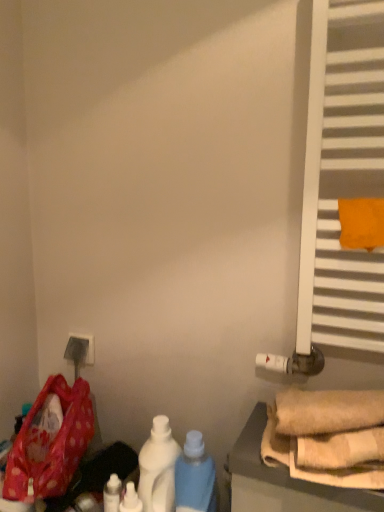
Question: Can you confirm if polka dot fabric bag at lower left is wider than white matte radiator at right?

Choices:
 (A) yes
 (B) no

Answer: (A)

Question: Would you say polka dot fabric bag at lower left is a long distance from white matte radiator at right?

Choices:
 (A) no
 (B) yes

Answer: (A)

Question: Can you confirm if polka dot fabric bag at lower left is thinner than white matte radiator at right?

Choices:
 (A) yes
 (B) no

Answer: (B)

Question: Does polka dot fabric bag at lower left have a smaller size compared to white matte radiator at right?

Choices:
 (A) yes
 (B) no

Answer: (A)

Question: Would you say white matte radiator at right is part of polka dot fabric bag at lower left's contents?

Choices:
 (A) no
 (B) yes

Answer: (A)

Question: Is point (117, 509) closer or farther from the camera than point (382, 198)?

Choices:
 (A) closer
 (B) farther

Answer: (B)

Question: Is white glossy bottle at lower left, marked as the 1th bottle in a left-to-right arrangement, inside the boundaries of orange fabric towel at right, or outside?

Choices:
 (A) inside
 (B) outside

Answer: (B)

Question: In the image, is white glossy bottle at lower left, marked as the 1th bottle in a left-to-right arrangement, positioned in front of or behind orange fabric towel at right?

Choices:
 (A) behind
 (B) front

Answer: (A)

Question: Considering the positions of white glossy bottle at lower left, marked as the 1th bottle in a left-to-right arrangement, and orange fabric towel at right in the image, is white glossy bottle at lower left, marked as the 1th bottle in a left-to-right arrangement, taller or shorter than orange fabric towel at right?

Choices:
 (A) tall
 (B) short

Answer: (A)

Question: In terms of height, does orange fabric towel at right look taller or shorter compared to white glossy bottle at lower left, positioned as the 4th bottle in right-to-left order?

Choices:
 (A) short
 (B) tall

Answer: (A)

Question: Is orange fabric towel at right spatially inside white glossy bottle at lower left, marked as the 1th bottle in a left-to-right arrangement, or outside of it?

Choices:
 (A) outside
 (B) inside

Answer: (A)

Question: Is orange fabric towel at right bigger or smaller than white glossy bottle at lower left, positioned as the 4th bottle in right-to-left order?

Choices:
 (A) small
 (B) big

Answer: (B)

Question: From a real-world perspective, is orange fabric towel at right positioned above or below white glossy bottle at lower left, positioned as the 4th bottle in right-to-left order?

Choices:
 (A) above
 (B) below

Answer: (A)

Question: Is white matte bottle at center, placed as the third bottle when sorted from left to right, taller or shorter than white glossy bottle at lower center, positioned as the 2th bottle in left-to-right order?

Choices:
 (A) short
 (B) tall

Answer: (B)

Question: Considering the positions of white matte bottle at center, placed as the second bottle when sorted from right to left, and white glossy bottle at lower center, which ranks as the third bottle in right-to-left order, in the image, is white matte bottle at center, placed as the second bottle when sorted from right to left, bigger or smaller than white glossy bottle at lower center, which ranks as the third bottle in right-to-left order,?

Choices:
 (A) big
 (B) small

Answer: (A)